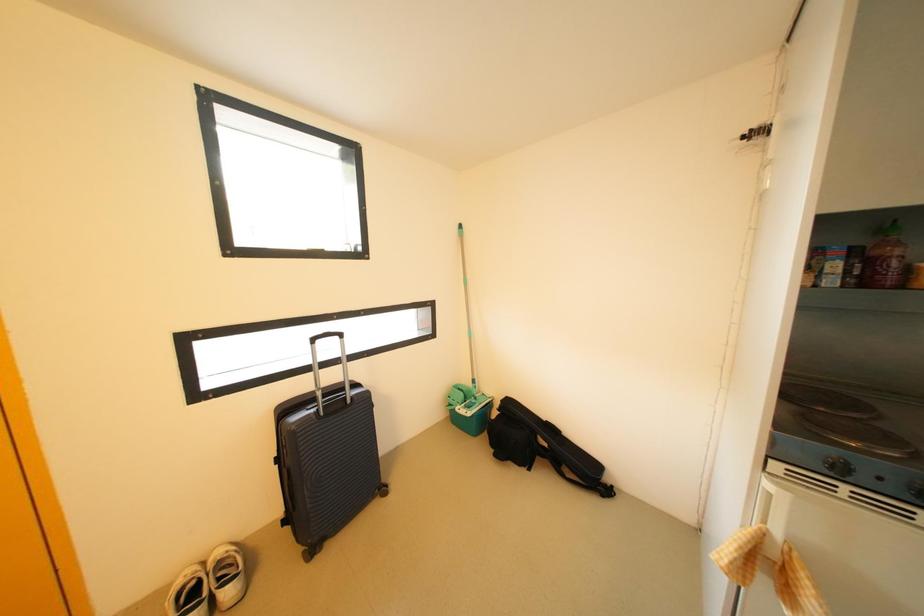
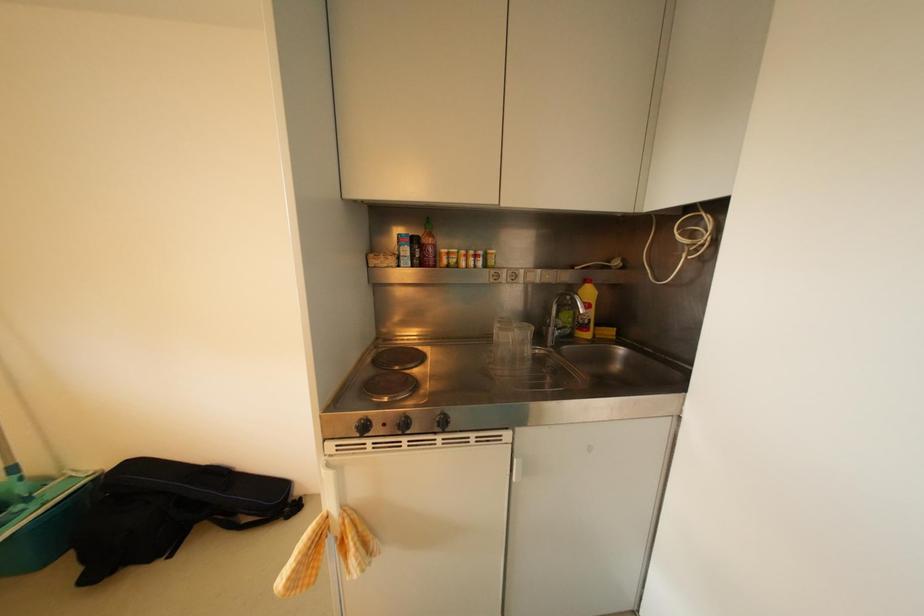
Question: The camera is either moving clockwise (left) or counter-clockwise (right) around the object. The first image is from the beginning of the video and the second image is from the end. Is the camera moving left or right when shooting the video?

Choices:
 (A) Left
 (B) Right

Answer: (A)